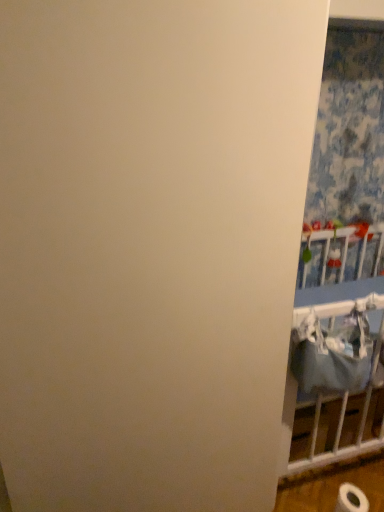
The image size is (384, 512). Describe the element at coordinates (331, 355) in the screenshot. I see `blue fabric laundry at right` at that location.

This screenshot has width=384, height=512. Find the location of `blue fabric laundry at right`. blue fabric laundry at right is located at coordinates (331, 355).

Locate an element on the screen. This screenshot has width=384, height=512. blue fabric laundry at right is located at coordinates (331, 355).